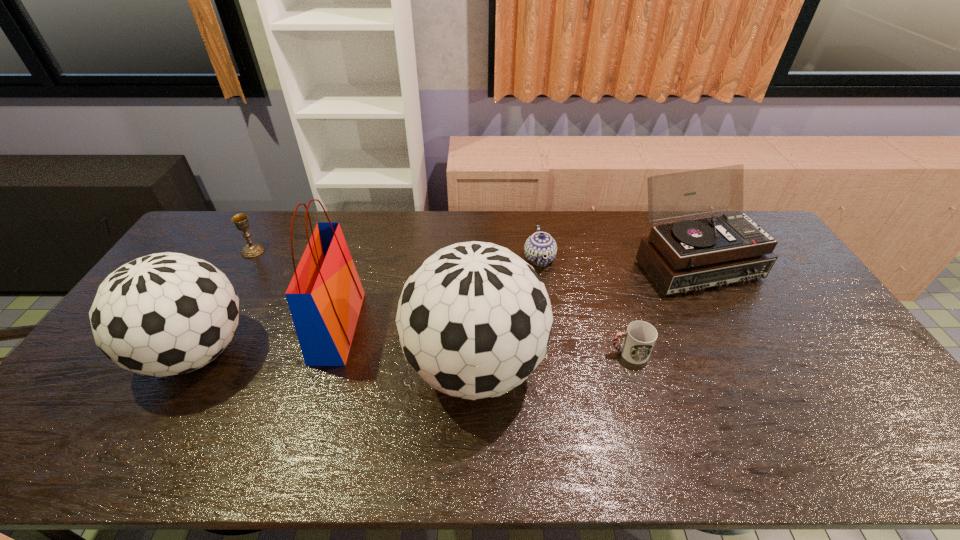
The width and height of the screenshot is (960, 540). What are the coordinates of `unoccupied area between the taller soccer ball and the cup` in the screenshot? It's located at click(552, 360).

This screenshot has width=960, height=540. In order to click on free space between the chalice and the right soccer ball in this screenshot , I will do `click(364, 308)`.

This screenshot has width=960, height=540. In order to click on vacant area that lies between the cup and the chinaware in this screenshot , I will do `click(584, 306)`.

Point out which object is positioned as the third nearest to the record player. Please provide its 2D coordinates. Your answer should be formatted as a tuple, i.e. [(x, y)], where the tuple contains the x and y coordinates of a point satisfying the conditions above.

[(474, 320)]

This screenshot has height=540, width=960. What are the coordinates of `object that can be found as the closest to the shortest object` in the screenshot? It's located at (689, 255).

Where is `vacant space that satisfies the following two spatial constraints: 1. on the back side of the right soccer ball; 2. on the left side of the rightmost object`? vacant space that satisfies the following two spatial constraints: 1. on the back side of the right soccer ball; 2. on the left side of the rightmost object is located at coordinates (476, 262).

Locate an element on the screen. The width and height of the screenshot is (960, 540). vacant space that satisfies the following two spatial constraints: 1. on the front side of the rightmost object; 2. on the handle side of the third object from left to right is located at coordinates (730, 327).

The width and height of the screenshot is (960, 540). What are the coordinates of `free point that satisfies the following two spatial constraints: 1. on the handle side of the shopping bag; 2. on the right side of the right soccer ball` in the screenshot? It's located at (325, 366).

Locate an element on the screen. This screenshot has height=540, width=960. free space that satisfies the following two spatial constraints: 1. on the front side of the right soccer ball; 2. on the right side of the shorter soccer ball is located at coordinates (188, 366).

Where is `blank area in the image that satisfies the following two spatial constraints: 1. on the handle side of the cup; 2. at the spout of the second shortest object`? blank area in the image that satisfies the following two spatial constraints: 1. on the handle side of the cup; 2. at the spout of the second shortest object is located at coordinates (600, 259).